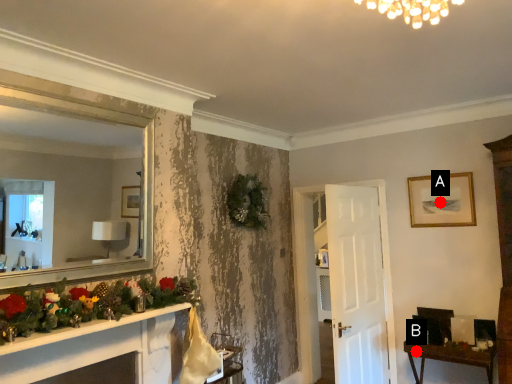
Question: Two points are circled on the image, labeled by A and B beside each circle. Which point is closer to the camera?

Choices:
 (A) A is closer
 (B) B is closer

Answer: (B)